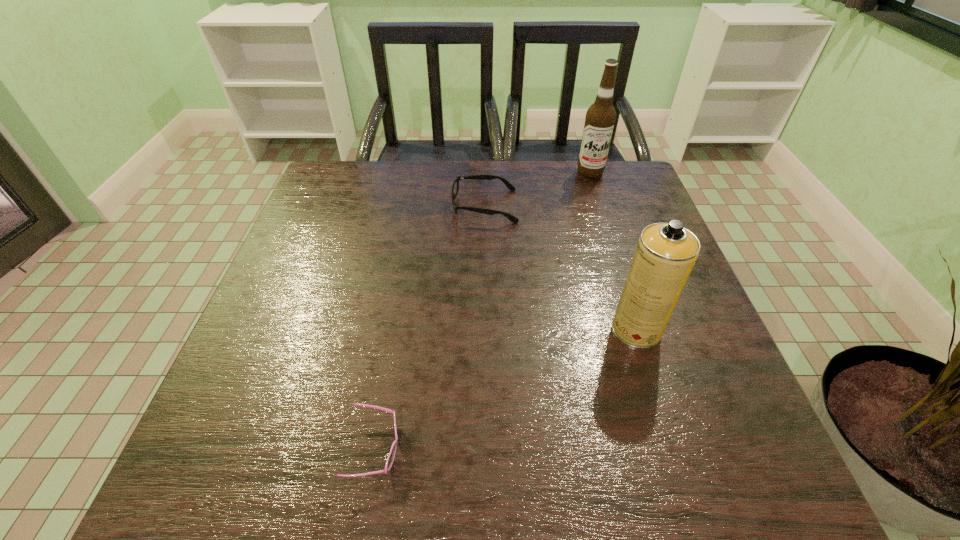
The image size is (960, 540). In order to click on the farthest object in this screenshot , I will do `click(600, 118)`.

Where is `the second tallest object`? This screenshot has width=960, height=540. the second tallest object is located at coordinates (665, 254).

This screenshot has height=540, width=960. In order to click on the third farthest object in this screenshot , I will do `click(665, 254)`.

Locate an element on the screen. The width and height of the screenshot is (960, 540). the second object from left to right is located at coordinates (455, 187).

Locate an element on the screen. spectacles is located at coordinates (455, 187).

Identify the location of sunglasses. (391, 456).

You are a GUI agent. You are given a task and a screenshot of the screen. Output one action in this format:
    pyautogui.click(x=<x>, y=<y>)
    Task: Click on the leftmost object
    This screenshot has height=540, width=960.
    Given the screenshot: What is the action you would take?
    pyautogui.click(x=391, y=456)

At what (x,y) coordinates should I click in order to perform the action: click on vacant space located 0.350m on the label of the farthest object. Please return your answer as a coordinate pair (x, y). This screenshot has width=960, height=540. Looking at the image, I should click on (619, 261).

Locate an element on the screen. free location located on the left of the third farthest object is located at coordinates (499, 329).

At what (x,y) coordinates should I click in order to perform the action: click on free region located 0.150m on the front-facing side of the second farthest object. Please return your answer as a coordinate pair (x, y). The image size is (960, 540). Looking at the image, I should click on click(x=396, y=206).